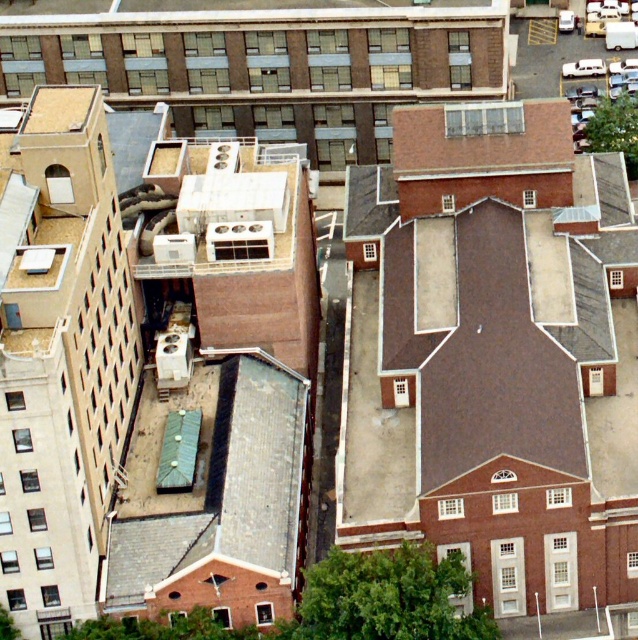
You are a drone operator flying over the city. You notice two roofs in the upper center area of the image. The roofs are labeled as smooth concrete roof at upper center and brown textured roof at upper center. Which of these two roofs is positioned higher in elevation?

The smooth concrete roof at upper center is located above the brown textured roof at upper center, so it is positioned higher in elevation.

You are standing at the origin point in the cityscape. Which of the two points, point [412,0] or point [464,115], is closer to you?

Point [464,115] is closer to you because it is in front of point [412,0].

Looking at the cityscape from above, you notice two roofs at the upper center area. Which one is positioned to the left between the smooth concrete roof at upper center and the brown textured roof at upper center?

The smooth concrete roof at upper center is located to the left of the brown textured roof at upper center.